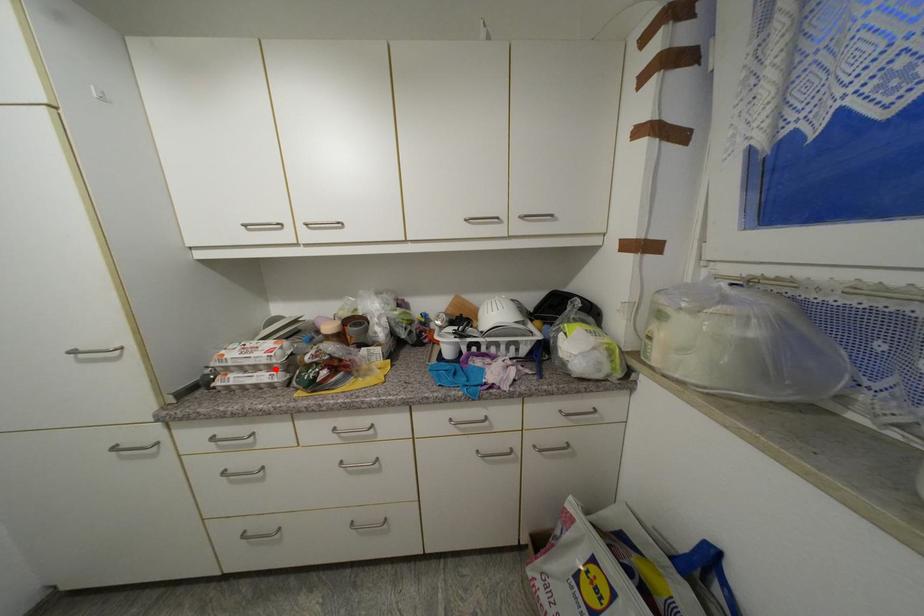
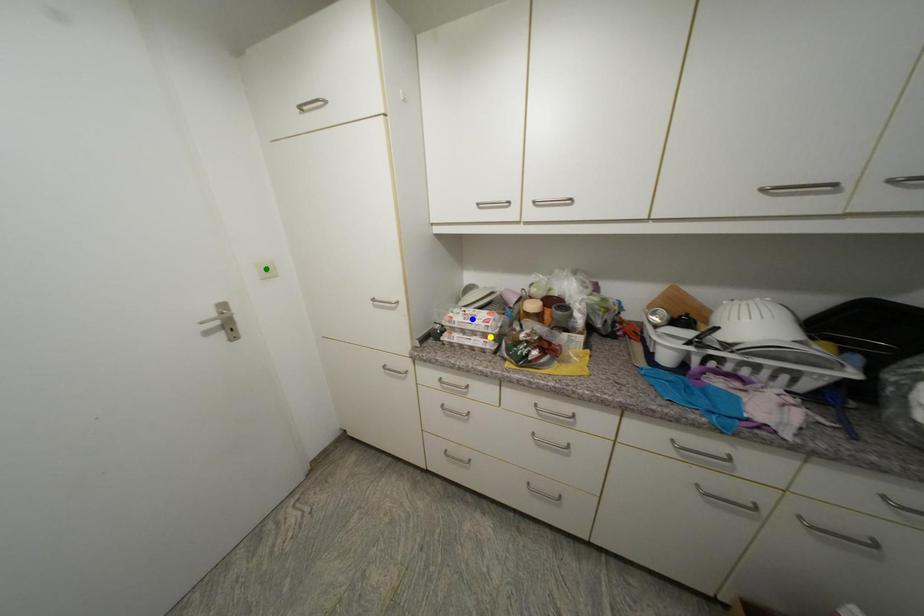
Question: I am providing you with two images of the same scene from different viewpoints. A red point is marked on the first image. You are given multiple points on the second image. Which point in image 2 represents the same 3d spot as the red point in image 1?

Choices:
 (A) yellow point
 (B) green point
 (C) blue point

Answer: (A)